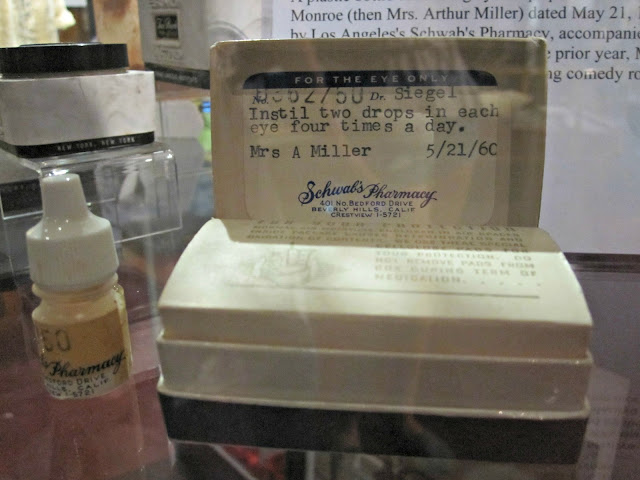
At what (x,y) coordinates should I click in order to perform the action: click on display case item. Please return your answer as a coordinate pair (x, y). Looking at the image, I should click on (64, 89), (124, 216), (164, 27), (383, 321), (580, 126).